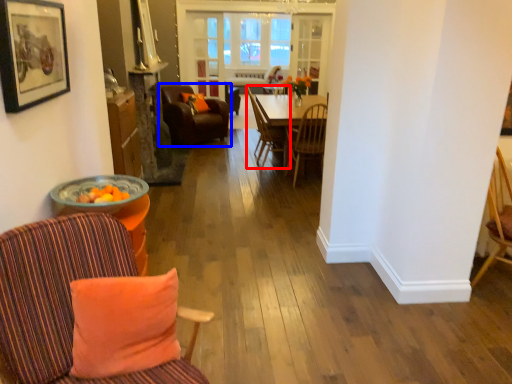
Question: Which object is closer to the camera taking this photo, chair (highlighted by a red box) or chair (highlighted by a blue box)?

Choices:
 (A) chair
 (B) chair

Answer: (A)